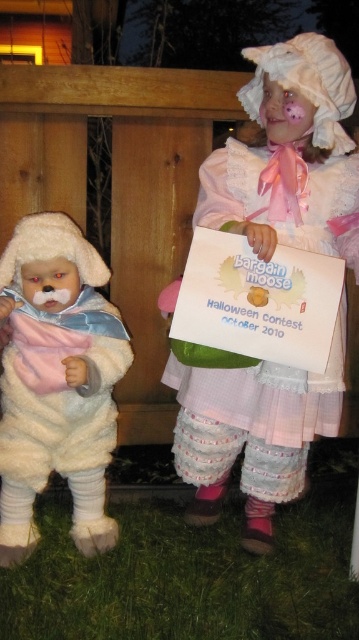
Question: Is white fluffy doll at upper center wider than fluffy white teddy bear at left?

Choices:
 (A) no
 (B) yes

Answer: (B)

Question: In this image, where is white fluffy doll at upper center located relative to fluffy white teddy bear at left?

Choices:
 (A) left
 (B) right

Answer: (B)

Question: Which of the following is the closest to the observer?

Choices:
 (A) fluffy white teddy bear at left
 (B) white fluffy doll at upper center

Answer: (B)

Question: Which point is closer to the camera?

Choices:
 (A) fluffy white teddy bear at left
 (B) white fluffy doll at upper center

Answer: (B)

Question: Can you confirm if white fluffy doll at upper center is positioned below fluffy white teddy bear at left?

Choices:
 (A) yes
 (B) no

Answer: (B)